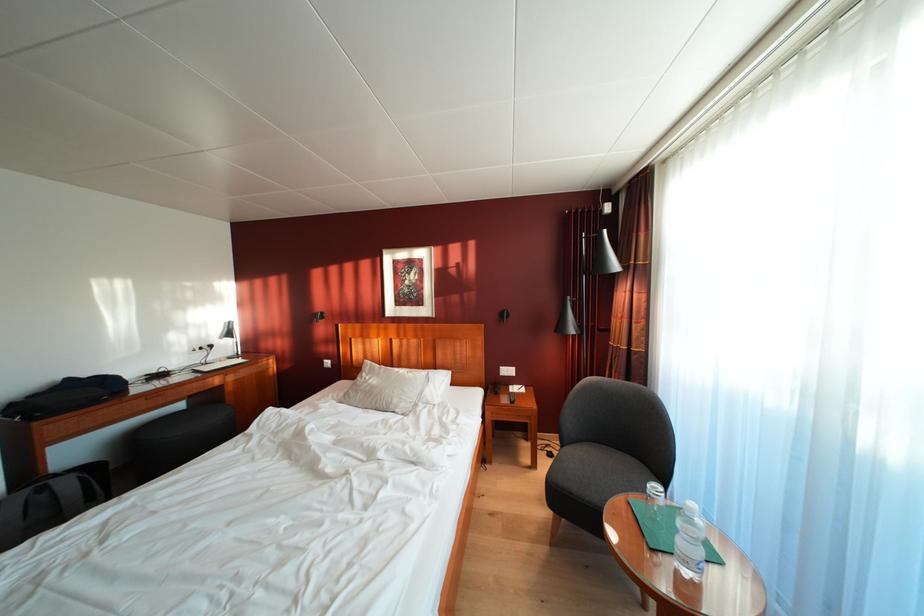
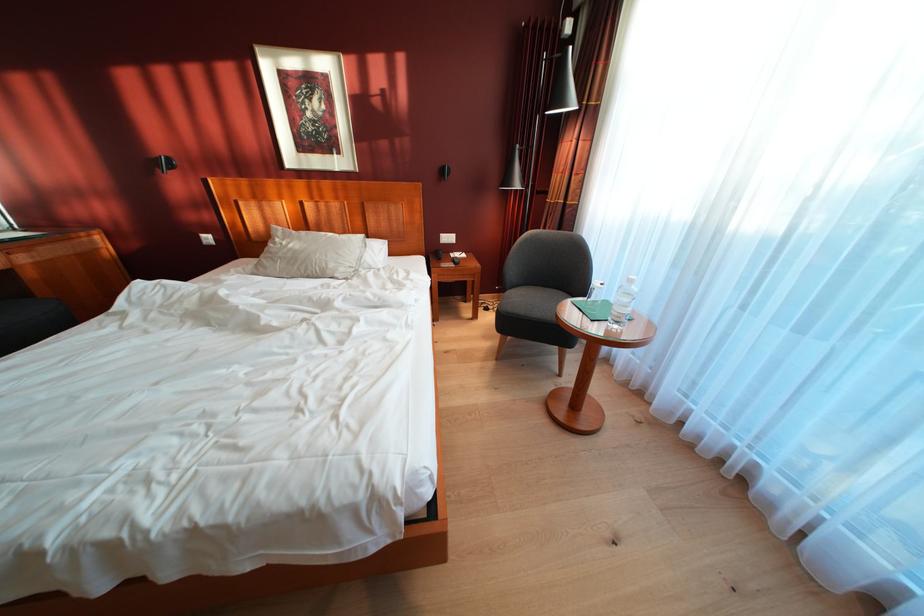
How did the camera likely rotate?

The camera's rotation is toward right-down.